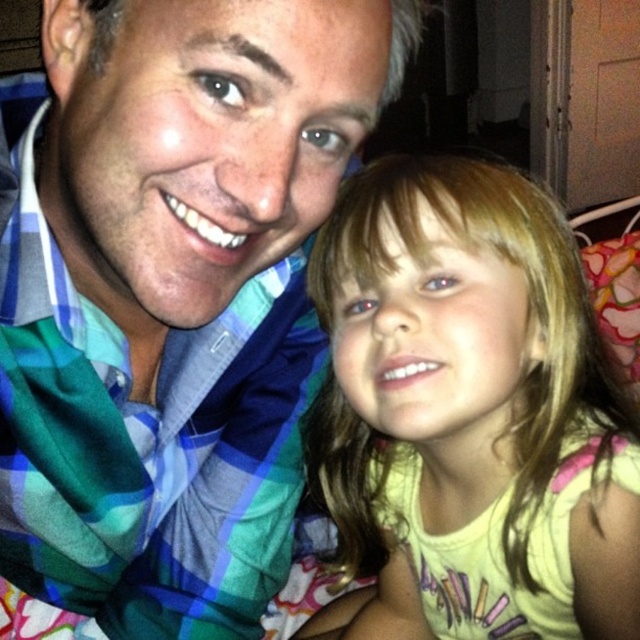
You are a photographer who needs to adjust the lighting to ensure both the blue plaid shirt at center and the yellow cotton shirt at center are visible. Since one is in front of the other, which one might need more light adjustment to make sure it doesn not block the other?

The blue plaid shirt at center is in front of the yellow cotton shirt at center, so the photographer should adjust the lighting on the blue plaid shirt at center to ensure it does not block the visibility of the yellow cotton shirt at center.

Based on the coordinates provided, which object in the scene is located at point (x=170, y=296)?

The point (x=170, y=296) corresponds to the blue plaid shirt at center.

You are a photographer adjusting the lighting in this indoor nighttime scene. You need to ensure that both the blue plaid shirt at center and the yellow cotton shirt at center are evenly lit. Given their current positions, how far apart are these two shirts?

The distance between the blue plaid shirt at center and the yellow cotton shirt at center is 6.18 inches.